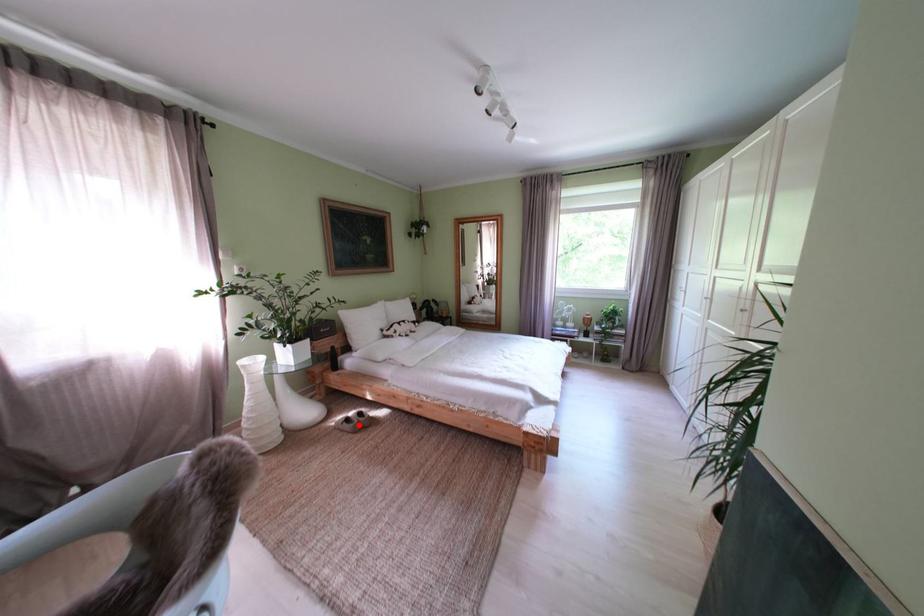
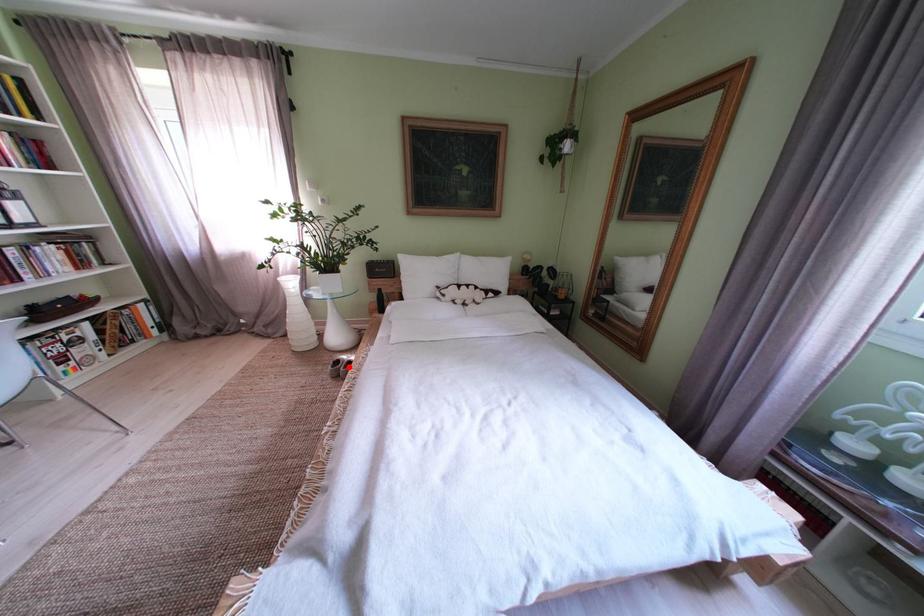
Looking at this image, I am providing you with two images of the same scene from different viewpoints. A red point is marked on the first image and another point is marked on the second image. Are the points marked in image1 and image2 representing the same 3D position?

Yes